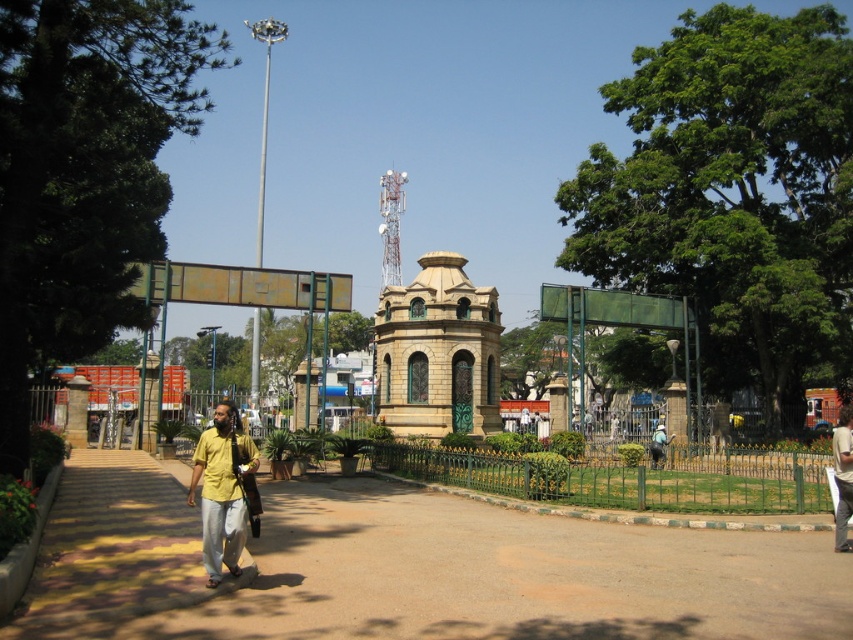
You are a photographer trying to capture the yellow shirt at center and the brown concrete pavement at center in a single shot. Based on their positions, which object should appear closer to the camera in the photo?

The yellow shirt at center is taller than the brown concrete pavement at center, so it will appear closer to the camera in the photo.

You are standing at the center of the image. Which direction should you look to see the yellow cotton shirt at lower left?

The yellow cotton shirt at lower left is located at point (222,490), which is to the lower left direction from the center of the image.